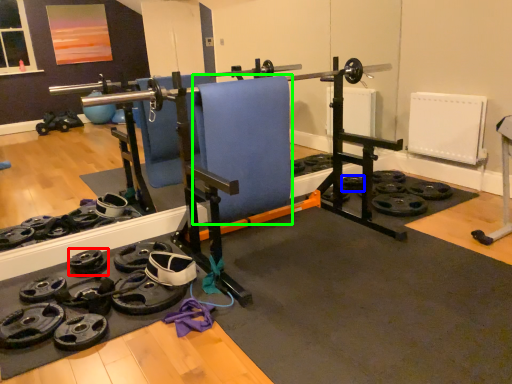
Question: Based on their relative distances, which object is nearer to wheel (highlighted by a red box)? Choose from wheel (highlighted by a blue box) and swivel chair (highlighted by a green box).

Choices:
 (A) wheel
 (B) swivel chair

Answer: (B)